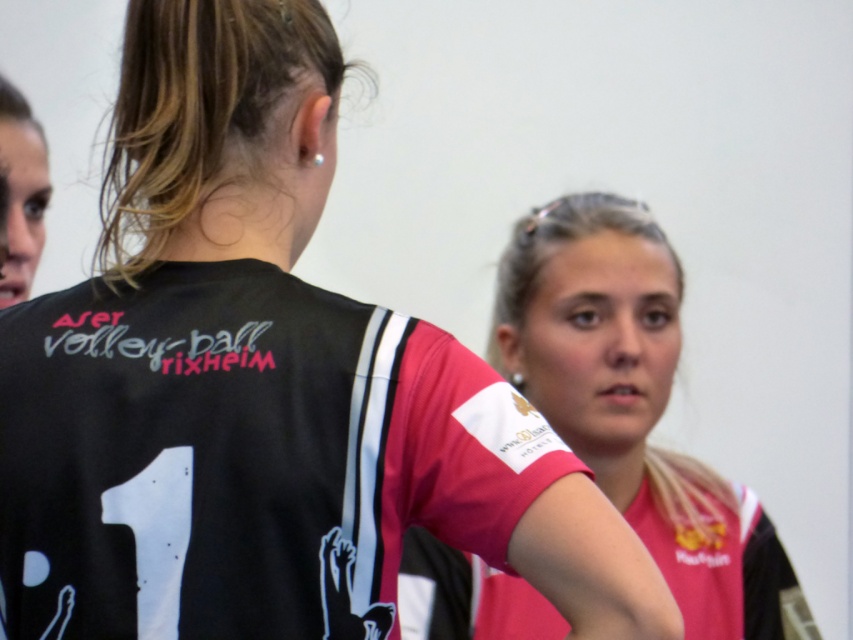
Question: Which object is closer to the camera taking this photo?

Choices:
 (A) black jersey at center
 (B) pink jersey at center

Answer: (A)

Question: Which of the following is the closest to the observer?

Choices:
 (A) (497, 612)
 (B) (108, 488)

Answer: (B)

Question: Does black jersey at center have a greater width compared to pink jersey at center?

Choices:
 (A) yes
 (B) no

Answer: (A)

Question: Is black jersey at center wider than pink jersey at center?

Choices:
 (A) yes
 (B) no

Answer: (A)

Question: Among these points, which one is nearest to the camera?

Choices:
 (A) (753, 598)
 (B) (258, 300)

Answer: (B)

Question: Is black jersey at center to the right of pink jersey at center from the viewer's perspective?

Choices:
 (A) no
 (B) yes

Answer: (A)